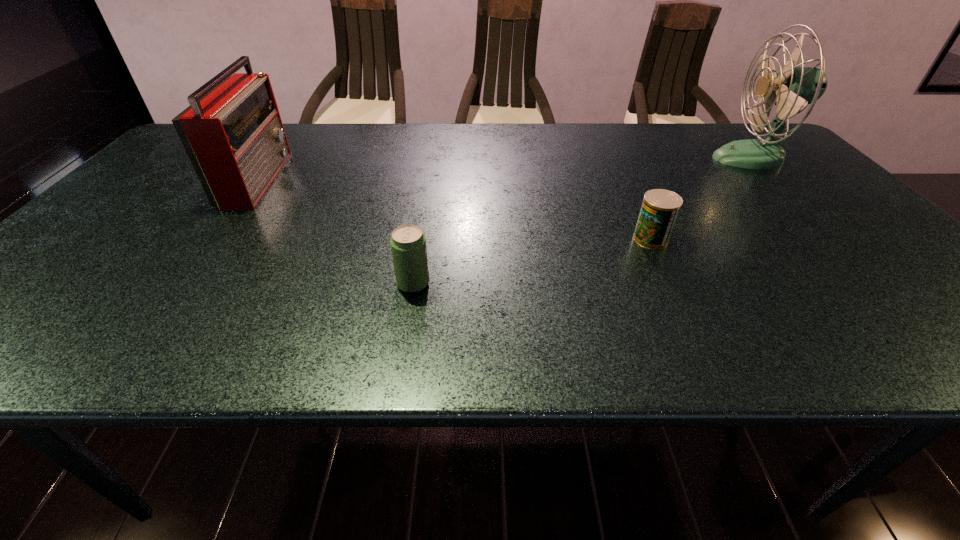
In order to click on free point between the fan and the leftmost object in this screenshot , I will do [505, 168].

Identify the location of vacant space that is in between the radio receiver and the second object from left to right. The image size is (960, 540). (336, 231).

Identify the location of object that is the closest to the can. 793,88.

This screenshot has width=960, height=540. Find the location of `the third closest object to the soda`. the third closest object to the soda is located at coordinates (793, 88).

Identify the location of free space that satisfies the following two spatial constraints: 1. on the front-facing side of the second object from left to right; 2. on the left side of the radio receiver. Image resolution: width=960 pixels, height=540 pixels. (180, 284).

This screenshot has height=540, width=960. I want to click on free location that satisfies the following two spatial constraints: 1. on the front-facing side of the third object from left to right; 2. on the left side of the radio receiver, so click(x=213, y=239).

Locate an element on the screen. This screenshot has height=540, width=960. vacant space that satisfies the following two spatial constraints: 1. in front of the fan, directing airflow; 2. on the front side of the nearest object is located at coordinates point(874,284).

The height and width of the screenshot is (540, 960). What are the coordinates of `vacant region that satisfies the following two spatial constraints: 1. on the back side of the shortest object; 2. on the right side of the nearest object` in the screenshot? It's located at (420, 239).

At what (x,y) coordinates should I click in order to perform the action: click on free space that satisfies the following two spatial constraints: 1. on the back side of the can; 2. on the front-facing side of the third shortest object. Please return your answer as a coordinate pair (x, y). Looking at the image, I should click on tap(622, 178).

In order to click on vacant region that satisfies the following two spatial constraints: 1. on the front-facing side of the third shortest object; 2. on the left side of the second object from right to left in this screenshot , I will do tap(213, 239).